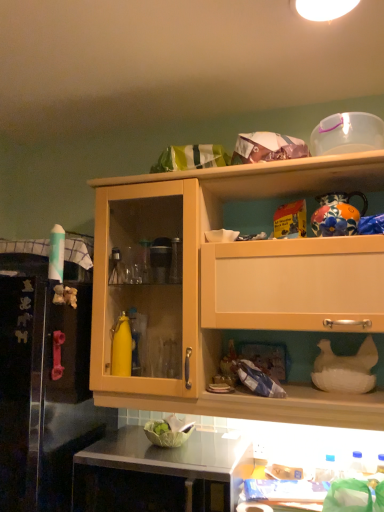
Question: Is white matte chicken at lower right, which is the 1th appliance from bottom to top, inside or outside of rubber pink handle at left?

Choices:
 (A) outside
 (B) inside

Answer: (A)

Question: In terms of height, does white matte chicken at lower right, which is the 1th appliance from bottom to top, look taller or shorter compared to rubber pink handle at left?

Choices:
 (A) short
 (B) tall

Answer: (A)

Question: Estimate the real-world distances between objects in this image. Which object is closer to the rubber pink handle at left?

Choices:
 (A) transparent plastic container at upper right, which is counted as the 1th appliance, starting from the top
 (B) black glossy countertop at lower center
 (C) wooden cabinet at upper center
 (D) white matte chicken at lower right, the second appliance when ordered from top to bottom
 (E) white glossy light fixture at upper center

Answer: (B)

Question: Which object is the farthest from the rubber pink handle at left?

Choices:
 (A) black glossy countertop at lower center
 (B) white glossy light fixture at upper center
 (C) transparent plastic container at upper right, which is counted as the 1th appliance, starting from the top
 (D) white matte chicken at lower right, which is the 1th appliance from bottom to top
 (E) wooden cabinet at upper center

Answer: (B)